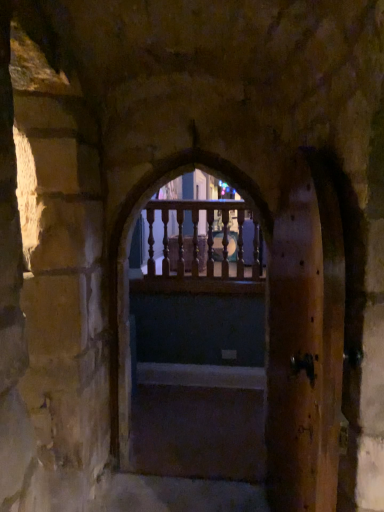
Question: Considering the relative positions of dark wood stairs at center and wooden railing at center in the image provided, is dark wood stairs at center to the left of wooden railing at center from the viewer's perspective?

Choices:
 (A) yes
 (B) no

Answer: (A)

Question: Is the position of dark wood stairs at center less distant than that of wooden railing at center?

Choices:
 (A) no
 (B) yes

Answer: (A)

Question: Is dark wood stairs at center further to camera compared to wooden railing at center?

Choices:
 (A) yes
 (B) no

Answer: (A)

Question: Is dark wood stairs at center placed right next to wooden railing at center?

Choices:
 (A) yes
 (B) no

Answer: (B)

Question: Is dark wood stairs at center oriented towards wooden railing at center?

Choices:
 (A) yes
 (B) no

Answer: (B)

Question: From a real-world perspective, is dark wood stairs at center positioned under wooden railing at center based on gravity?

Choices:
 (A) no
 (B) yes

Answer: (B)

Question: From a real-world perspective, is brown wooden screen door at right beneath wooden railing at center?

Choices:
 (A) yes
 (B) no

Answer: (A)

Question: Does brown wooden screen door at right have a greater height compared to wooden railing at center?

Choices:
 (A) no
 (B) yes

Answer: (A)

Question: Considering the relative positions of brown wooden screen door at right and wooden railing at center in the image provided, is brown wooden screen door at right in front of wooden railing at center?

Choices:
 (A) yes
 (B) no

Answer: (A)

Question: Is brown wooden screen door at right completely or partially outside of wooden railing at center?

Choices:
 (A) no
 (B) yes

Answer: (B)

Question: Can you confirm if brown wooden screen door at right is wider than wooden railing at center?

Choices:
 (A) no
 (B) yes

Answer: (A)

Question: Considering the relative sizes of brown wooden screen door at right and wooden railing at center in the image provided, is brown wooden screen door at right shorter than wooden railing at center?

Choices:
 (A) no
 (B) yes

Answer: (B)

Question: Considering the relative sizes of brown wooden screen door at right and transparent wooden railing at center in the image provided, is brown wooden screen door at right thinner than transparent wooden railing at center?

Choices:
 (A) yes
 (B) no

Answer: (B)